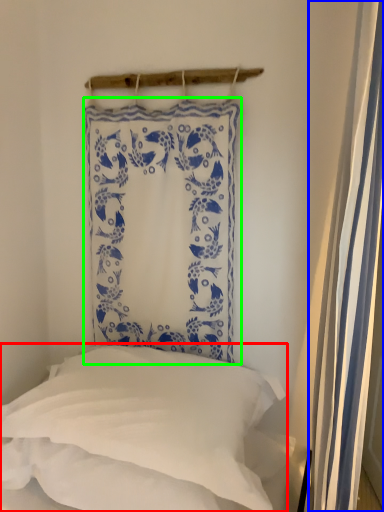
Question: Based on their relative distances, which object is nearer to pillow (highlighted by a red box)? Choose from shower curtain (highlighted by a blue box) and curtain (highlighted by a green box).

Choices:
 (A) shower curtain
 (B) curtain

Answer: (B)